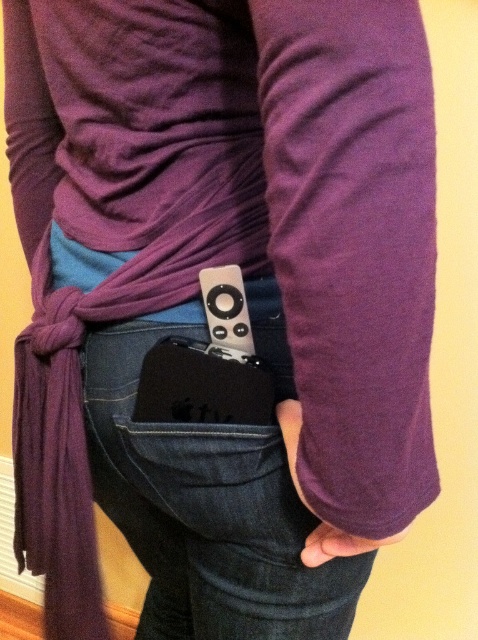
You are standing in front of the person in the image. You want to place a small sticker on the point that is closer to you. Which point should you choose between the point at coordinates point (271, 570) and point (332, 548)?

Point (332, 548) is closer to you because it is in front of point (271, 570).

You are a photographer setting up a shoot in the scene described. You need to place a small prop exactly at the point labeled as point [227,312]. What object will the prop be placed on top of?

The prop will be placed on top of the satin black remote at center located at point [227,312].

You are a fashion designer analyzing the image. You need to determine which item is more suitable for a minimalist design concept. The purple fabric scarf at center and the satin black remote at center are both in the center. Which one takes up more space?

The purple fabric scarf at center is bigger than the satin black remote at center, so it takes up more space.